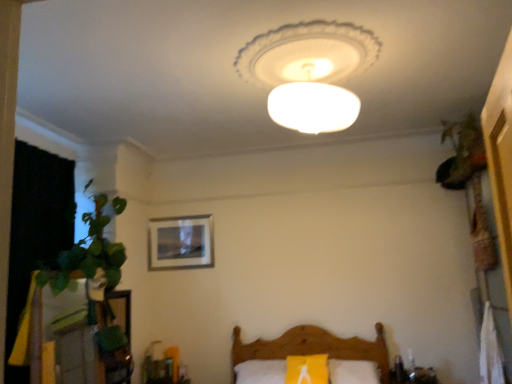
Question: Is white frosted glass lampshade at center inside the boundaries of wooden bed at lower center, or outside?

Choices:
 (A) outside
 (B) inside

Answer: (A)

Question: From the image's perspective, relative to wooden bed at lower center, is white frosted glass lampshade at center above or below?

Choices:
 (A) above
 (B) below

Answer: (A)

Question: Which of these objects is positioned closest to the wooden bed at lower center?

Choices:
 (A) green leafy plant at upper right
 (B) wooden picture frame at center
 (C) white frosted glass lampshade at center

Answer: (B)

Question: Based on their relative distances, which object is farther from the white frosted glass lampshade at center?

Choices:
 (A) wooden bed at lower center
 (B) wooden picture frame at center
 (C) green leafy plant at upper right

Answer: (A)